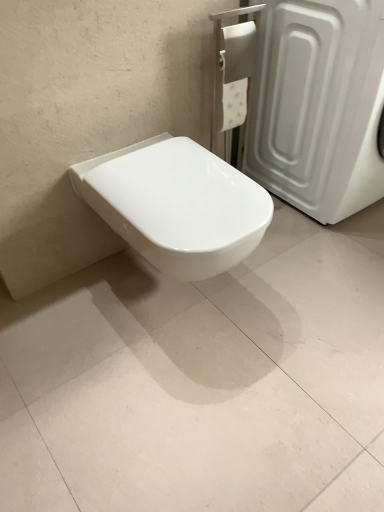
I want to click on free space above white glossy toilet at center (from a real-world perspective), so click(163, 167).